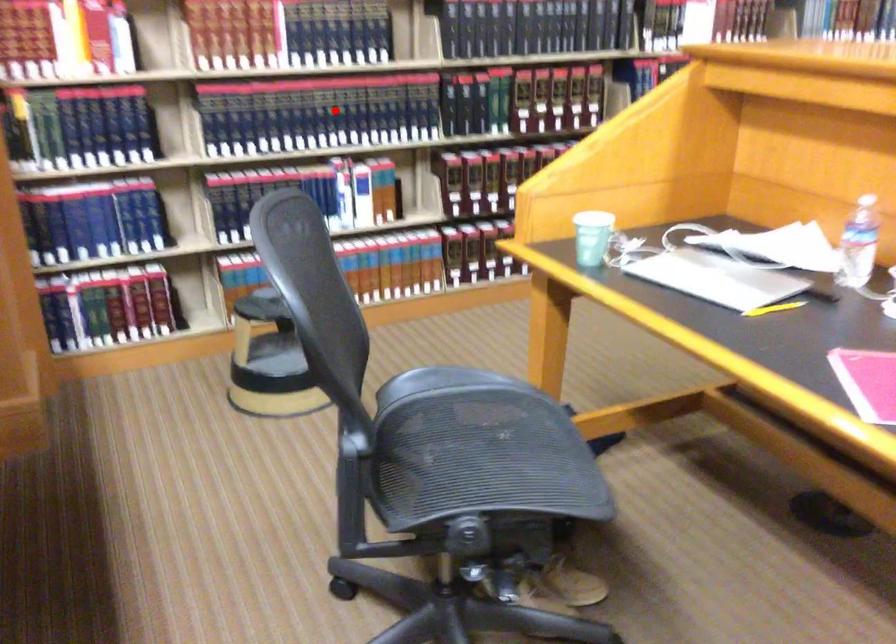
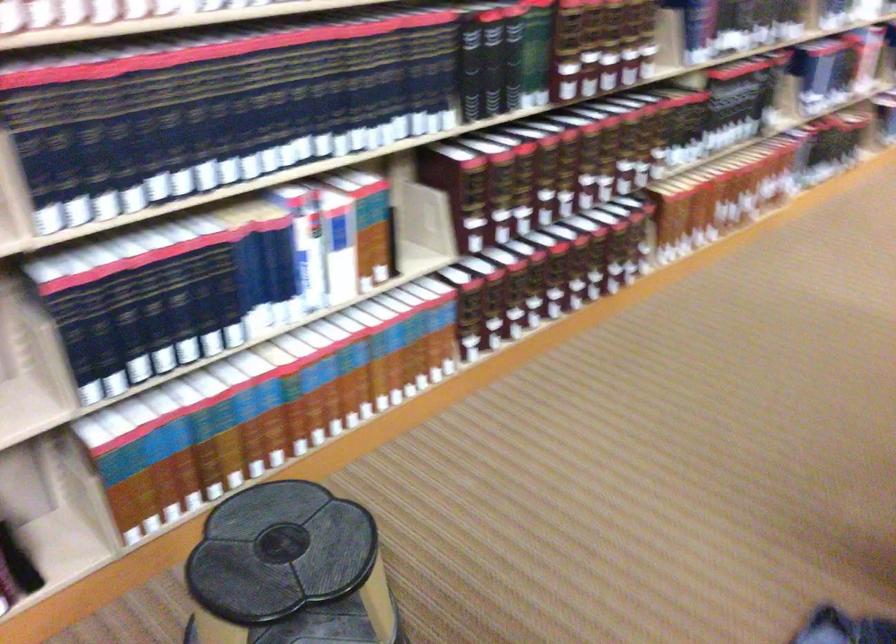
Question: I am providing you with two images of the same scene from different viewpoints. Given a red point in image1, look at the same physical point in image2. Is it:

Choices:
 (A) Closer to the viewpoint
 (B) Farther from the viewpoint

Answer: (A)